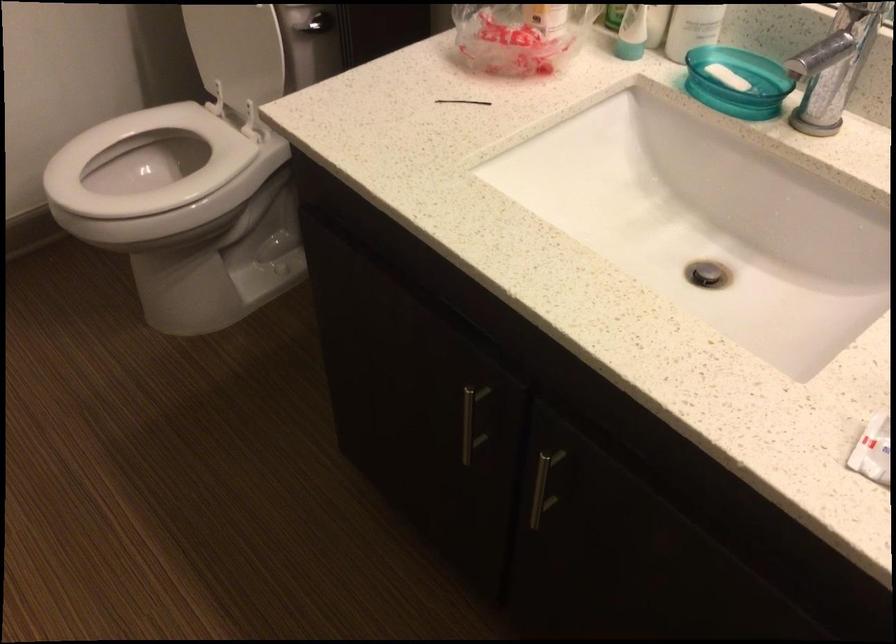
Identify the location of sink drain plug. This screenshot has height=644, width=896. (707, 274).